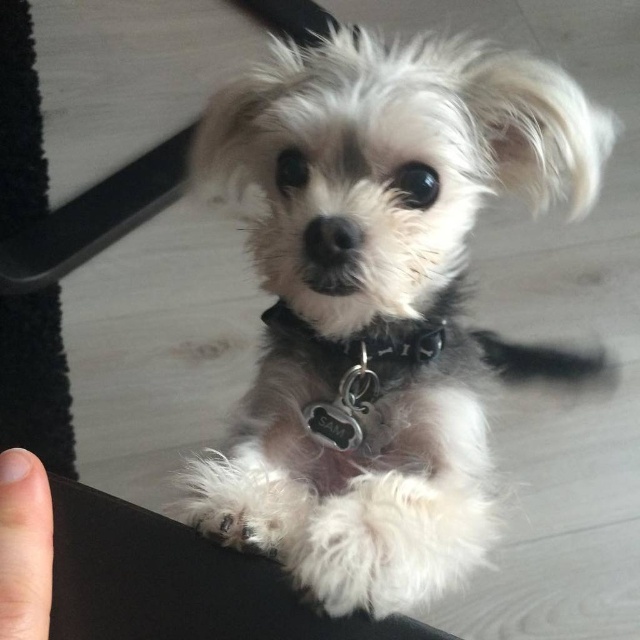
Question: Which point is farther from the camera taking this photo?

Choices:
 (A) (486, 156)
 (B) (429, 337)
 (C) (40, 506)

Answer: (B)

Question: Observing the image, what is the correct spatial positioning of white fluffy dog at center in reference to black leather collar at center?

Choices:
 (A) below
 (B) above

Answer: (A)

Question: Does white fluffy dog at center have a lesser width compared to black leather collar at center?

Choices:
 (A) yes
 (B) no

Answer: (B)

Question: In this image, where is smooth skin finger at lower left located relative to black leather collar at center?

Choices:
 (A) left
 (B) right

Answer: (A)

Question: Based on their relative distances, which object is farther from the black leather collar at center?

Choices:
 (A) white fluffy dog at center
 (B) smooth skin finger at lower left

Answer: (B)

Question: Among these objects, which one is nearest to the camera?

Choices:
 (A) smooth skin finger at lower left
 (B) black leather collar at center

Answer: (A)